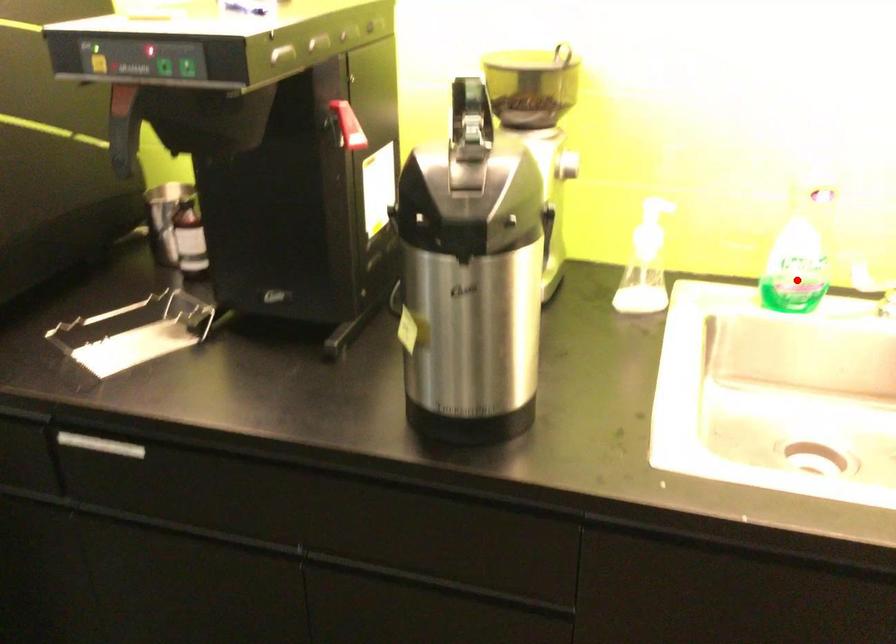
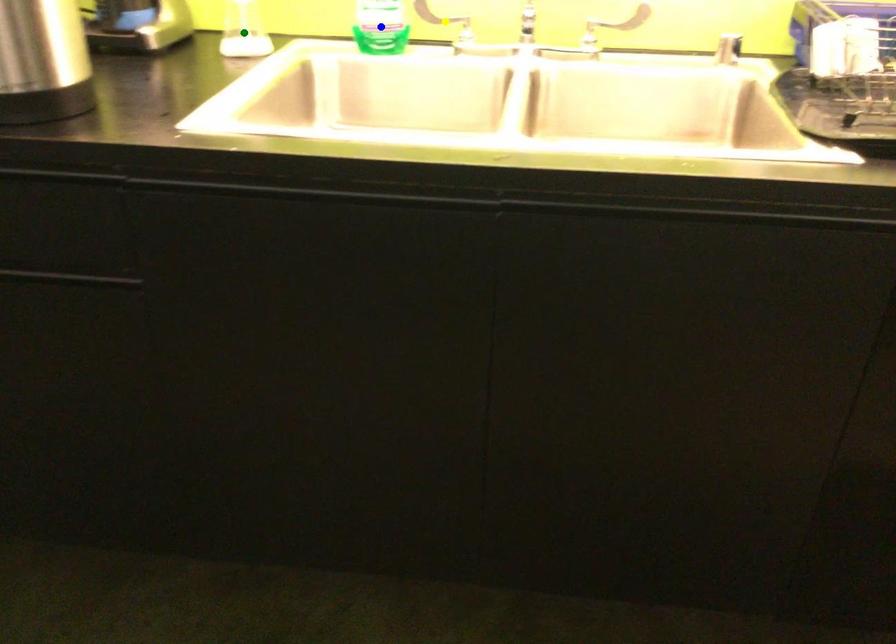
Question: I am providing you with two images of the same scene from different viewpoints. A red point is marked on the first image. You are given multiple points on the second image. Which point in image 2 is actually the same real-world point as the red point in image 1?

Choices:
 (A) green point
 (B) yellow point
 (C) blue point

Answer: (C)